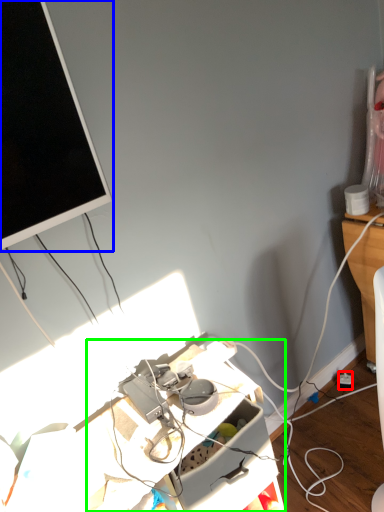
Question: Estimate the real-world distances between objects in this image. Which object is farther from power outlet (highlighted by a red box), television (highlighted by a blue box) or computer desk (highlighted by a green box)?

Choices:
 (A) television
 (B) computer desk

Answer: (A)